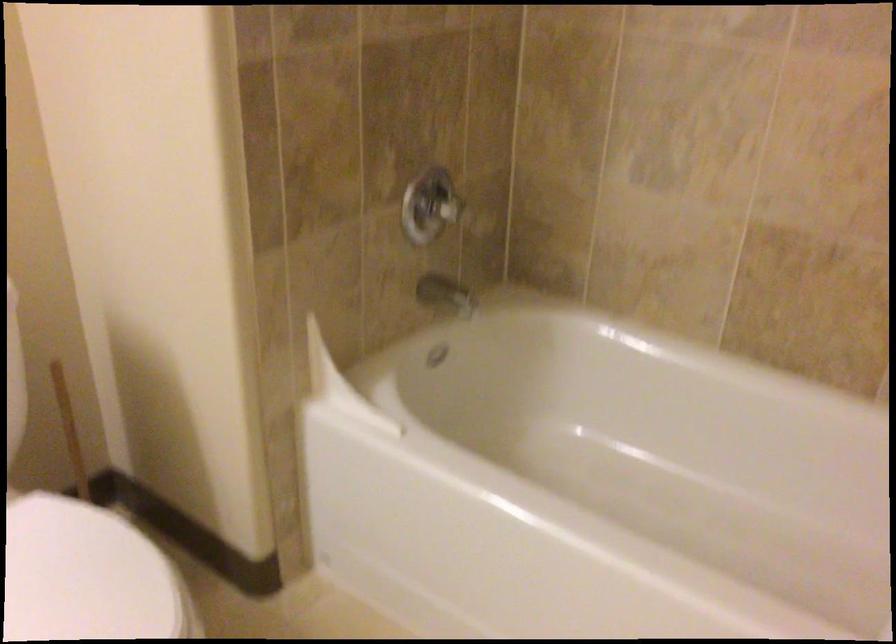
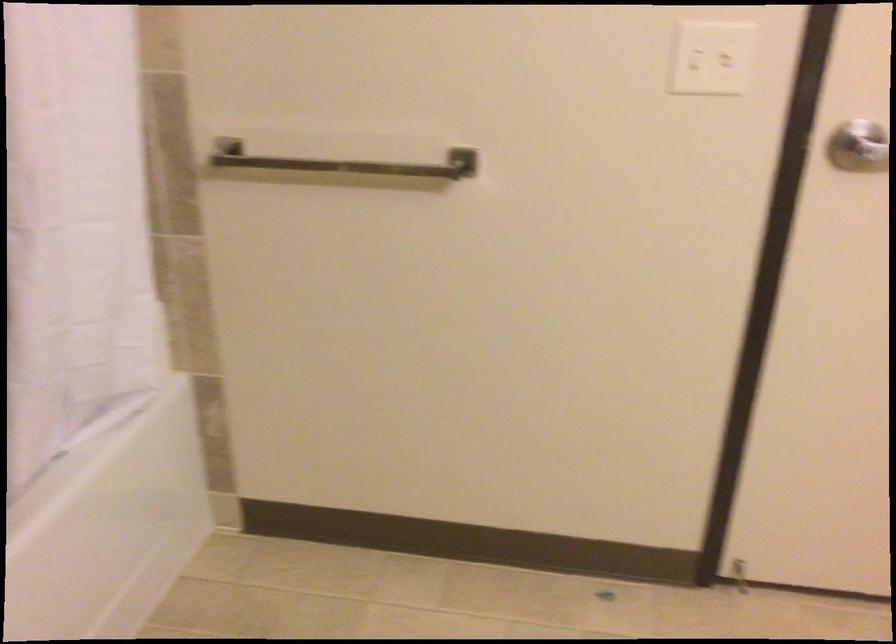
Based on the continuous images, in which direction is the camera rotating?

The camera's rotation is toward right-down.